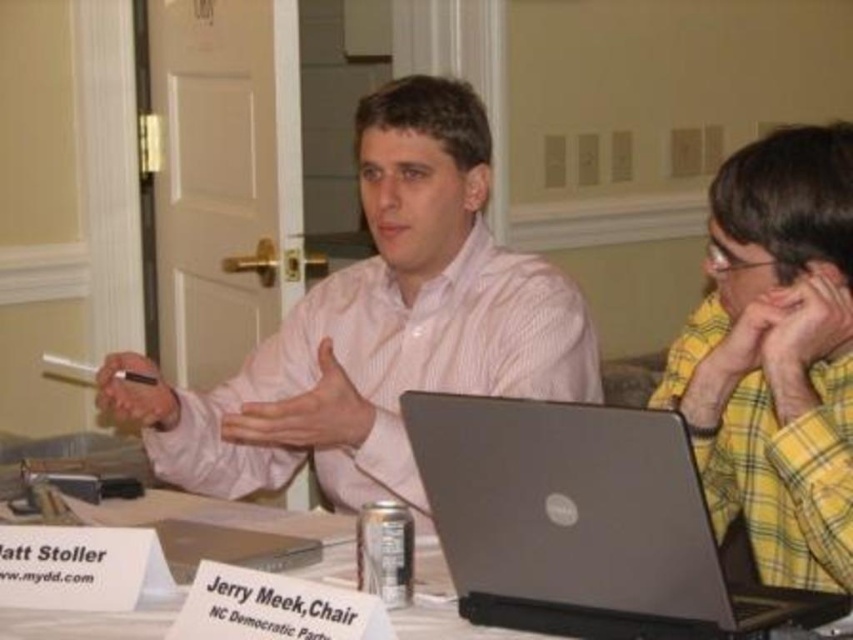
You are an interior designer planning to place a decorative item between the yellow plaid shirt at right and the white paper at center. Considering their widths, which object should the decorative item be closer to?

The yellow plaid shirt at right has a smaller width compared to the white paper at center. Therefore, the decorative item should be placed closer to the yellow plaid shirt at right to balance the space effectively.

You are a designer who needs to place a new object between the pink striped shirt at center and the white paper at center. Considering their thickness, which object should be placed closer to the thinner one?

The pink striped shirt at center is thinner than the white paper at center, so the new object should be placed closer to the pink striped shirt at center.

What object is located at the coordinates point (583,524)?

The silver metallic laptop at center is located at the coordinates point (583,524).